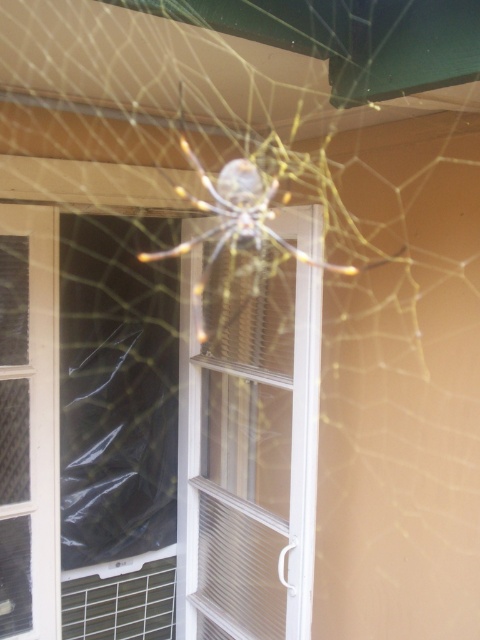
Is clear plastic screen door at left in front of translucent yellow spider at center?

No, it is behind translucent yellow spider at center.

Measure the distance between clear plastic screen door at left and translucent yellow spider at center.

clear plastic screen door at left and translucent yellow spider at center are 61.91 centimeters apart from each other.

The height and width of the screenshot is (640, 480). Describe the element at coordinates (31, 406) in the screenshot. I see `clear plastic screen door at left` at that location.

The height and width of the screenshot is (640, 480). What are the coordinates of `clear plastic screen door at left` in the screenshot? It's located at (31, 406).

Measure the distance between clear plastic screen door at center and camera.

clear plastic screen door at center and camera are 1.68 meters apart.

At what (x,y) coordinates should I click in order to perform the action: click on clear plastic screen door at center. Please return your answer as a coordinate pair (x, y). The width and height of the screenshot is (480, 640). Looking at the image, I should click on (250, 465).

Measure the distance between clear plastic screen door at center and clear plastic screen door at left.

22.94 inches

The height and width of the screenshot is (640, 480). What do you see at coordinates (250, 465) in the screenshot?
I see `clear plastic screen door at center` at bounding box center [250, 465].

Is point (191, 552) positioned after point (10, 611)?

Yes, point (191, 552) is behind point (10, 611).

Where is `clear plastic screen door at center`? The width and height of the screenshot is (480, 640). clear plastic screen door at center is located at coordinates (250, 465).